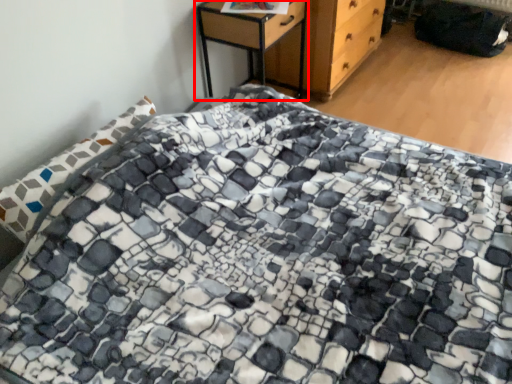
Question: From the image's perspective, considering the relative positions of nightstand (annotated by the red box) and chest of drawers in the image provided, where is nightstand (annotated by the red box) located with respect to the staircase?

Choices:
 (A) below
 (B) above

Answer: (A)